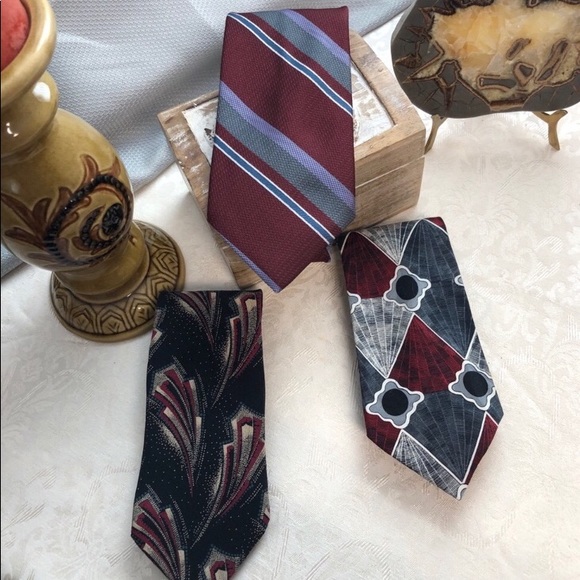
This screenshot has width=580, height=580. In order to click on box in this screenshot , I will do `click(371, 170)`, `click(371, 190)`, `click(192, 158)`.